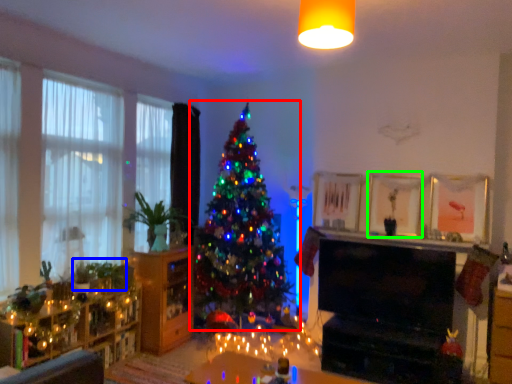
Question: Which is nearer to the christmas tree (highlighted by a red box)? plant (highlighted by a blue box) or picture frame (highlighted by a green box).

Choices:
 (A) plant
 (B) picture frame

Answer: (A)